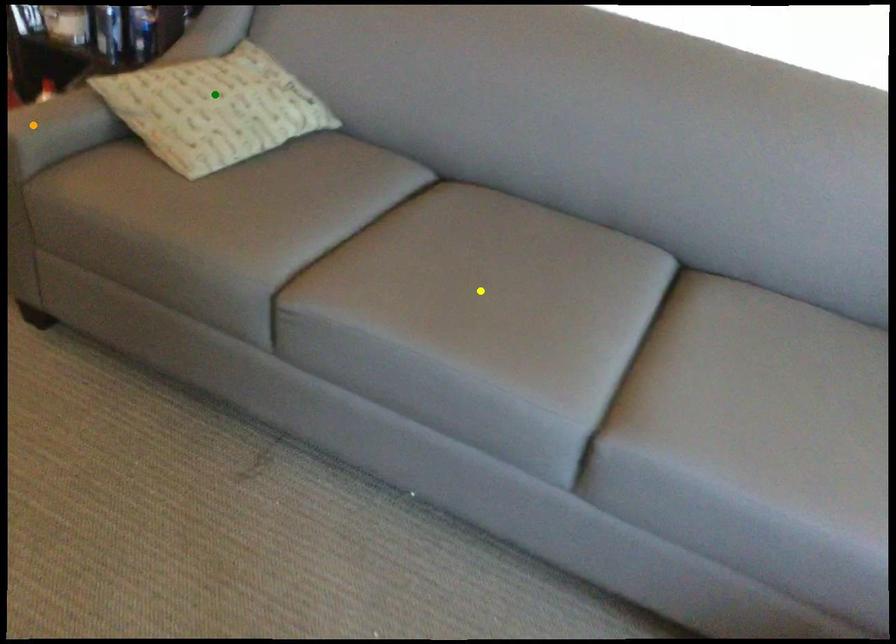
Order these from nearest to farthest:
1. green point
2. orange point
3. yellow point

yellow point
orange point
green point